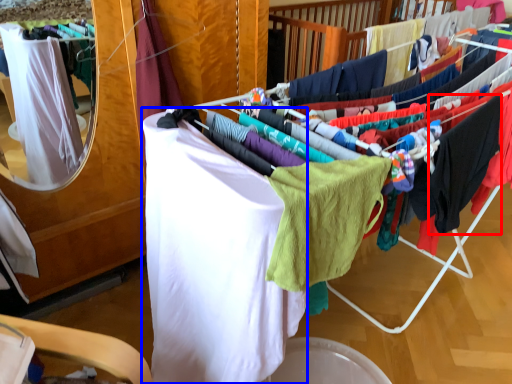
Question: Among these objects, which one is nearest to the camera, clothing (highlighted by a red box) or clothing (highlighted by a blue box)?

Choices:
 (A) clothing
 (B) clothing

Answer: (B)